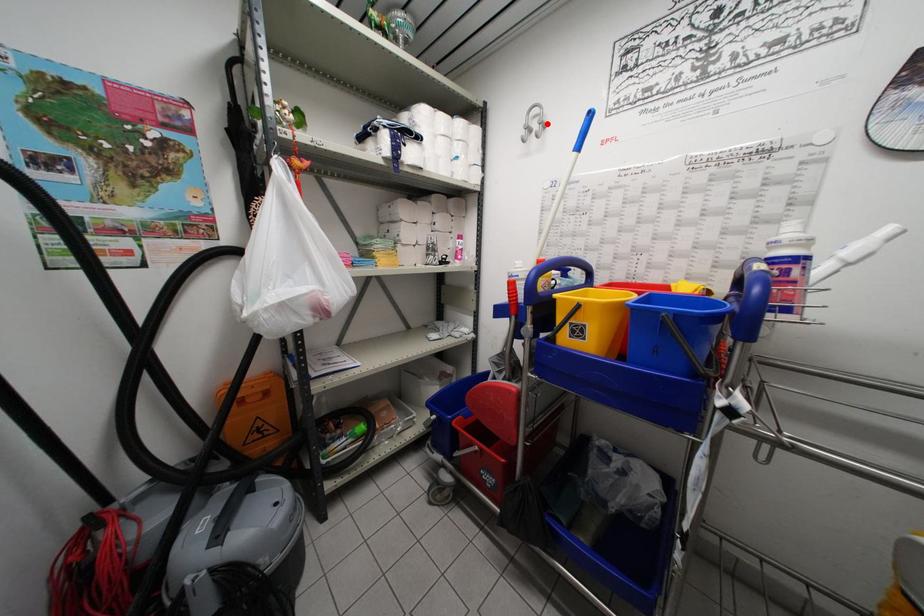
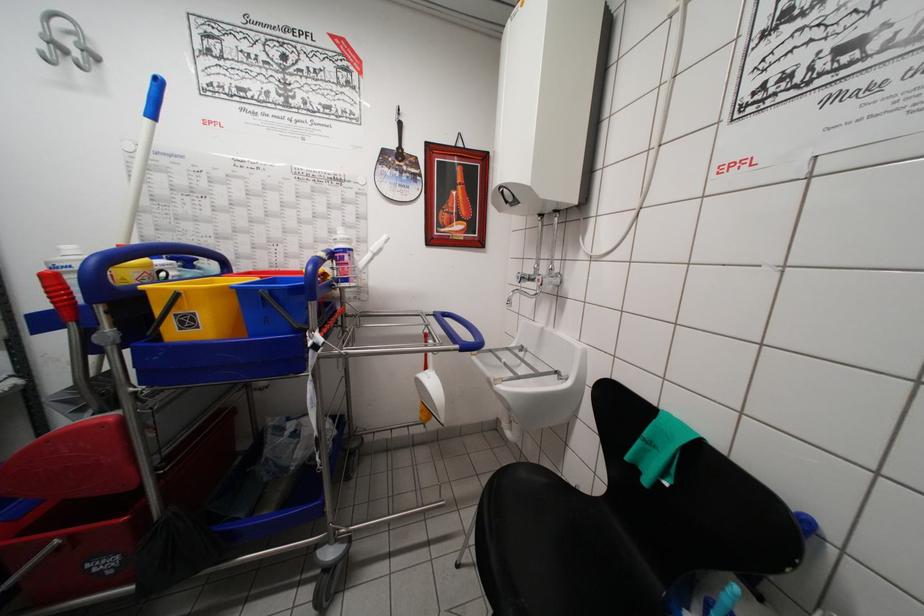
Locate, in the second image, the point that corresponds to the highlighted location in the first image.

(92, 51)